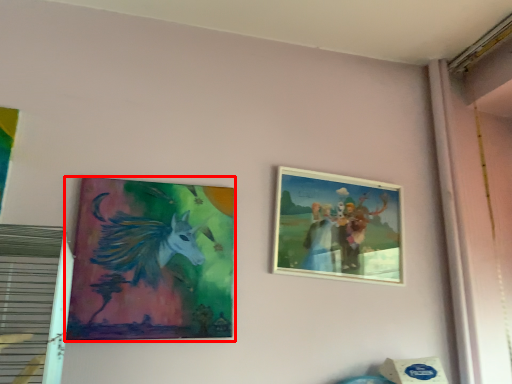
Question: From the image's perspective, where is picture frame (annotated by the red box) located in relation to picture frame in the image?

Choices:
 (A) below
 (B) above

Answer: (A)